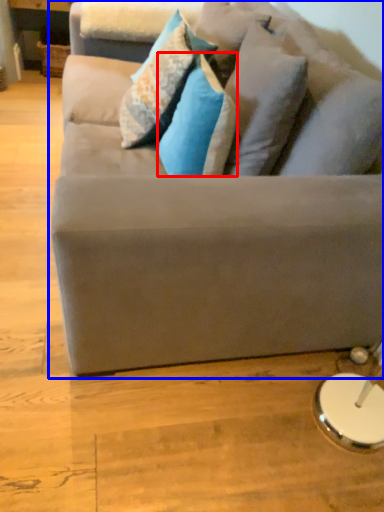
Question: Which of the following is the closest to the observer, pillow (highlighted by a red box) or studio couch (highlighted by a blue box)?

Choices:
 (A) pillow
 (B) studio couch

Answer: (B)